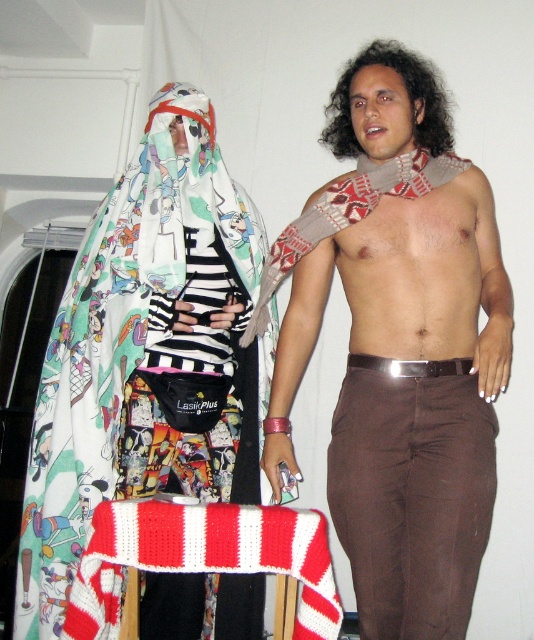
You are a photographer setting up a shoot in this scene. You need to arrange two knitted red and white scarves so that one is to the left of the other. Based on the current positions of the knitted red and white scarf at left and knitted red and white scarf at center, which scarf should you move to achieve the desired arrangement?

The knitted red and white scarf at left is already positioned on the left side of the knitted red and white scarf at center, so no movement is needed as they are already arranged with the left scarf to the left of the center scarf.

You are an artist trying to sketch the scene. You need to place the skinny brown muscle at center accurately. According to the coordinates given, where should you position it on your drawing canvas?

The skinny brown muscle at center should be positioned at coordinates point (418, 272) on the drawing canvas.